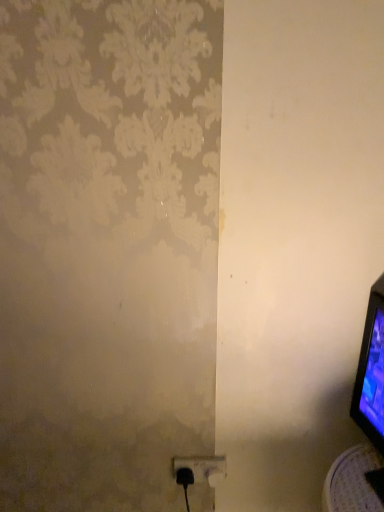
Locate an element on the screen. This screenshot has height=512, width=384. black plastic power plug at lower center is located at coordinates (199, 469).

The height and width of the screenshot is (512, 384). Describe the element at coordinates (199, 469) in the screenshot. I see `black plastic power plug at lower center` at that location.

Where is `black plastic power plug at lower center`? Image resolution: width=384 pixels, height=512 pixels. black plastic power plug at lower center is located at coordinates (199, 469).